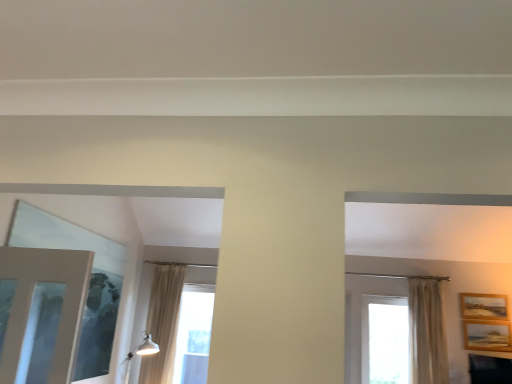
Question: Which direction should I rotate to look at transparent glass window at center, positioned as the 3th window in left-to-right order?

Choices:
 (A) left
 (B) right

Answer: (B)

Question: Does white sheer curtain at right have a greater height compared to white glossy light fixture at lower left?

Choices:
 (A) yes
 (B) no

Answer: (A)

Question: From the image's perspective, is white sheer curtain at right below white glossy light fixture at lower left?

Choices:
 (A) yes
 (B) no

Answer: (B)

Question: Does white sheer curtain at right have a lesser height compared to white glossy light fixture at lower left?

Choices:
 (A) no
 (B) yes

Answer: (A)

Question: From the image's perspective, is white sheer curtain at right over white glossy light fixture at lower left?

Choices:
 (A) yes
 (B) no

Answer: (A)

Question: Can white glossy light fixture at lower left be found inside white sheer curtain at right?

Choices:
 (A) no
 (B) yes

Answer: (A)

Question: Is white sheer curtain at right at the right side of white glossy light fixture at lower left?

Choices:
 (A) yes
 (B) no

Answer: (A)

Question: From a real-world perspective, is transparent glass window at center, the 1th window in the right-to-left sequence, positioned over white glossy light fixture at lower left based on gravity?

Choices:
 (A) no
 (B) yes

Answer: (B)

Question: From a real-world perspective, is transparent glass window at center, the 1th window in the right-to-left sequence, beneath white glossy light fixture at lower left?

Choices:
 (A) no
 (B) yes

Answer: (A)

Question: Considering the relative positions of transparent glass window at center, the 1th window in the right-to-left sequence, and white glossy light fixture at lower left in the image provided, is transparent glass window at center, the 1th window in the right-to-left sequence, in front of white glossy light fixture at lower left?

Choices:
 (A) no
 (B) yes

Answer: (A)

Question: Can you confirm if transparent glass window at center, positioned as the 3th window in left-to-right order, is bigger than white glossy light fixture at lower left?

Choices:
 (A) yes
 (B) no

Answer: (B)

Question: Is transparent glass window at center, positioned as the 3th window in left-to-right order, smaller than white glossy light fixture at lower left?

Choices:
 (A) no
 (B) yes

Answer: (B)

Question: Is transparent glass window at center, positioned as the 3th window in left-to-right order, oriented towards white glossy light fixture at lower left?

Choices:
 (A) yes
 (B) no

Answer: (B)

Question: Is transparent glass window at center, arranged as the second window when viewed from the left, smaller than wooden textured picture frame at right, the first picture frame from the bottom?

Choices:
 (A) yes
 (B) no

Answer: (B)